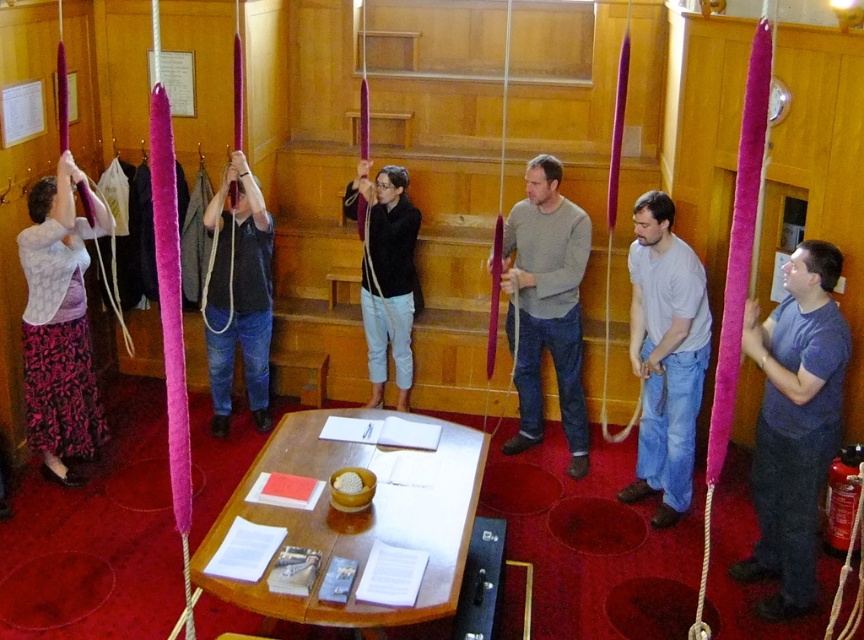
Is matte purple skirt at left to the left of matte purple rope at center from the viewer's perspective?

Correct, you'll find matte purple skirt at left to the left of matte purple rope at center.

Find the location of a particular element. matte purple skirt at left is located at coordinates (59, 323).

Image resolution: width=864 pixels, height=640 pixels. I want to click on matte purple skirt at left, so pos(59,323).

Which is below, gray sweater at center or matte black shirt at center?

gray sweater at center is below.

Can you confirm if gray sweater at center is taller than matte black shirt at center?

Yes, gray sweater at center is taller than matte black shirt at center.

The height and width of the screenshot is (640, 864). What do you see at coordinates (545, 307) in the screenshot?
I see `gray sweater at center` at bounding box center [545, 307].

This screenshot has height=640, width=864. In order to click on gray sweater at center in this screenshot , I will do `click(545, 307)`.

Does wooden table at center have a larger size compared to purple silky rope at center?

Correct, wooden table at center is larger in size than purple silky rope at center.

What do you see at coordinates (359, 518) in the screenshot?
I see `wooden table at center` at bounding box center [359, 518].

Between point (454, 577) and point (617, 128), which one is positioned in front?

Positioned in front is point (617, 128).

Where is `wooden table at center`? wooden table at center is located at coordinates (359, 518).